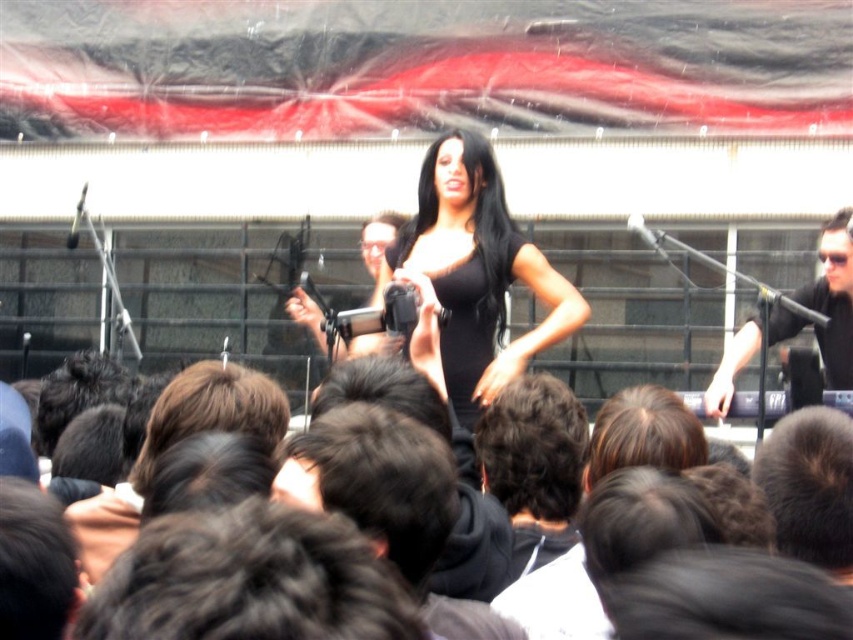
Question: In this image, where is metallic silver microphone at upper center located relative to black shiny hair at center?

Choices:
 (A) left
 (B) right

Answer: (B)

Question: Estimate the real-world distances between objects in this image. Which object is farther from the metallic silver microphone at upper center?

Choices:
 (A) black matte dress at center
 (B) black matte microphone at right
 (C) black silky hair at center
 (D) black satin dress at center

Answer: (D)

Question: Among these objects, which one is nearest to the camera?

Choices:
 (A) black shiny hair at center
 (B) metallic silver microphone at upper center

Answer: (A)

Question: Where is black satin dress at center located in relation to matte black microphone at center in the image?

Choices:
 (A) below
 (B) above

Answer: (A)

Question: Which point is closer to the camera taking this photo?

Choices:
 (A) (82, 209)
 (B) (654, 240)
 (C) (494, 168)

Answer: (C)

Question: Can you confirm if black matte dress at center is thinner than metallic silver microphone at upper left?

Choices:
 (A) yes
 (B) no

Answer: (B)